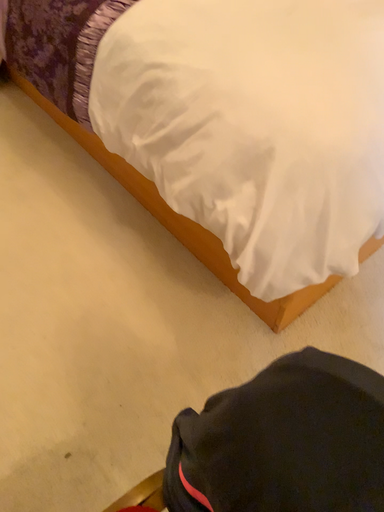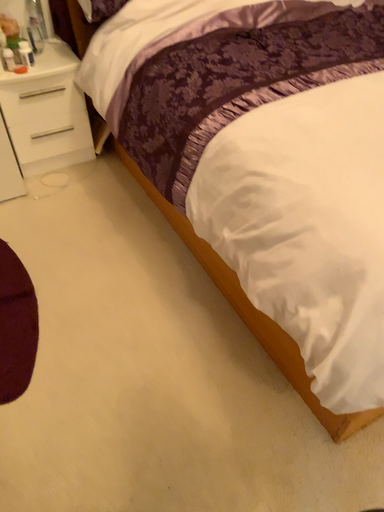
Question: How did the camera likely rotate when shooting the video?

Choices:
 (A) rotated downward
 (B) rotated upward

Answer: (B)